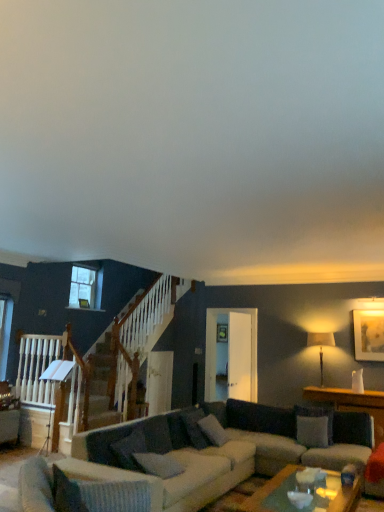
Question: Which direction should I rotate to look at gray fabric pillow at center, which is the second pillow from left to right, — up or down?

Choices:
 (A) up
 (B) down

Answer: (B)

Question: From a real-world perspective, is clear glass window at upper left positioned over textured gray couch at center based on gravity?

Choices:
 (A) yes
 (B) no

Answer: (A)

Question: Is clear glass window at upper left to the right of textured gray couch at center from the viewer's perspective?

Choices:
 (A) no
 (B) yes

Answer: (A)

Question: From the image's perspective, is clear glass window at upper left beneath textured gray couch at center?

Choices:
 (A) yes
 (B) no

Answer: (B)

Question: Can you confirm if clear glass window at upper left is taller than textured gray couch at center?

Choices:
 (A) no
 (B) yes

Answer: (B)

Question: Is the position of clear glass window at upper left more distant than that of textured gray couch at center?

Choices:
 (A) yes
 (B) no

Answer: (A)

Question: Is clear glass window at upper left thinner than textured gray couch at center?

Choices:
 (A) no
 (B) yes

Answer: (B)

Question: Is white textured pillow at lower left, placed as the first pillow when sorted from left to right, outside textured gray couch at center?

Choices:
 (A) no
 (B) yes

Answer: (B)

Question: Can you see white textured pillow at lower left, which ranks as the 4th pillow in right-to-left order, touching textured gray couch at center?

Choices:
 (A) no
 (B) yes

Answer: (A)

Question: Considering the relative positions of white textured pillow at lower left, which ranks as the 4th pillow in right-to-left order, and textured gray couch at center in the image provided, is white textured pillow at lower left, which ranks as the 4th pillow in right-to-left order, to the left of textured gray couch at center from the viewer's perspective?

Choices:
 (A) no
 (B) yes

Answer: (B)

Question: Can you confirm if white textured pillow at lower left, acting as the 4th pillow starting from the back, is positioned to the right of textured gray couch at center?

Choices:
 (A) yes
 (B) no

Answer: (B)

Question: Would you say textured gray couch at center is part of white textured pillow at lower left, acting as the 4th pillow starting from the back,'s contents?

Choices:
 (A) yes
 (B) no

Answer: (B)

Question: Considering the relative sizes of white textured pillow at lower left, acting as the 4th pillow starting from the back, and textured gray couch at center in the image provided, is white textured pillow at lower left, acting as the 4th pillow starting from the back, shorter than textured gray couch at center?

Choices:
 (A) yes
 (B) no

Answer: (A)

Question: From the image's perspective, is wooden table at right beneath gray fabric pillow at center, the 3th pillow from the back?

Choices:
 (A) yes
 (B) no

Answer: (A)